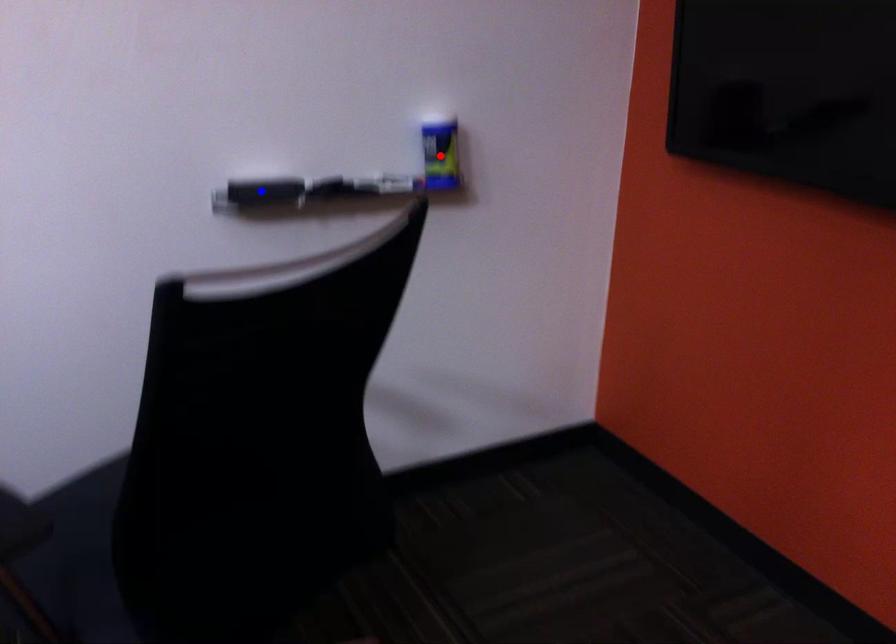
Question: Which of the two points in the image is closer to the camera?

Choices:
 (A) Blue point is closer.
 (B) Red point is closer.

Answer: (A)